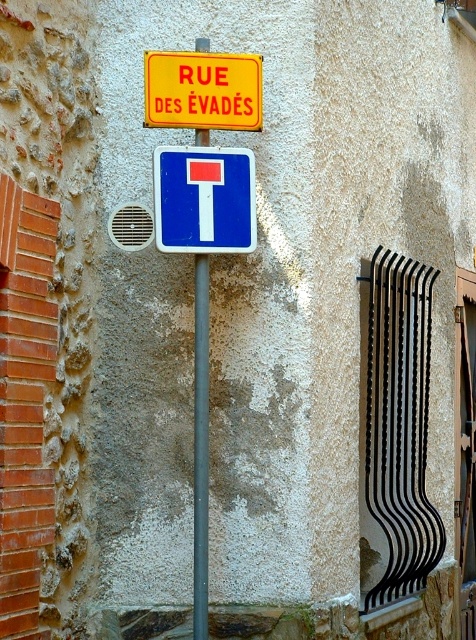
You are standing in front of the street sign and want to determine the spatial relationship between the two points marked on the image. Which point is closer to you, point [156,56] or point [207,506]?

Point [207,506] is closer to you because point [156,56] is behind it.

You are standing in front of the street sign and want to touch the point located at coordinates (204, 198). Which object on the sign should you aim for?

The point at coordinates (204, 198) is on the blue plastic sign at center, so you should aim for the blue rectangular sign with the white T symbol.